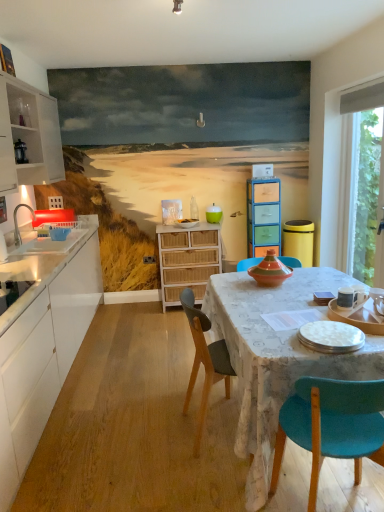
Identify the location of free region on the left part of white glossy plate at lower right, acting as the 2th tableware starting from the right. (273, 344).